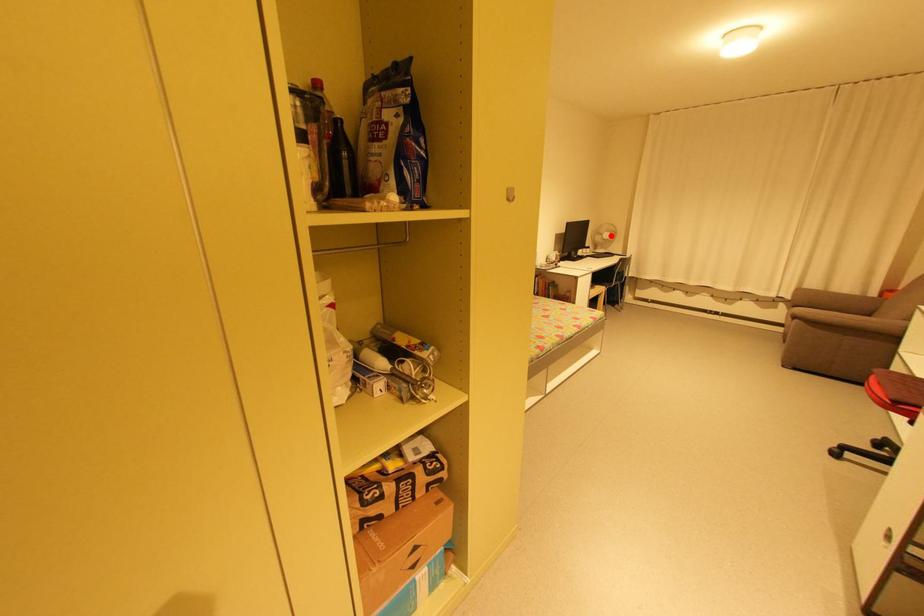
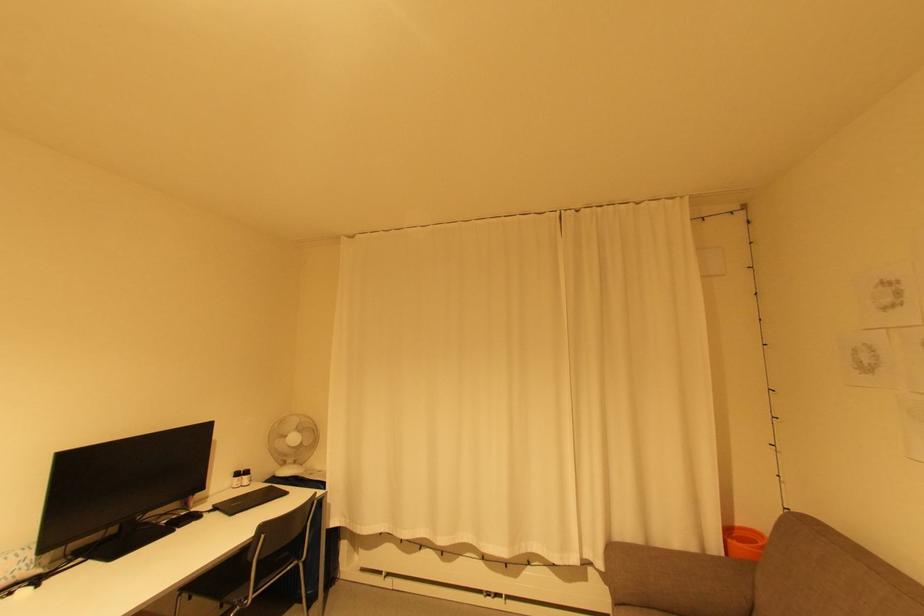
Locate, in the second image, the point that corresponds to the highlighted location in the first image.

(298, 439)